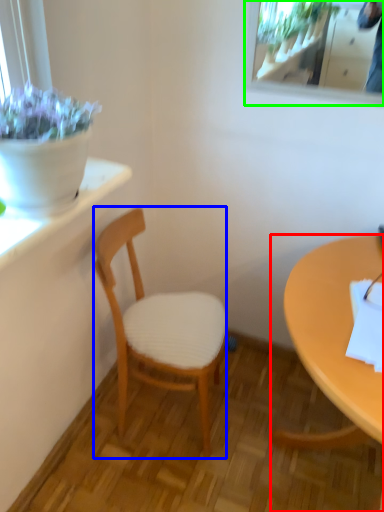
Question: Which is nearer to the desk (highlighted by a red box)? chair (highlighted by a blue box) or mirror (highlighted by a green box).

Choices:
 (A) chair
 (B) mirror

Answer: (A)